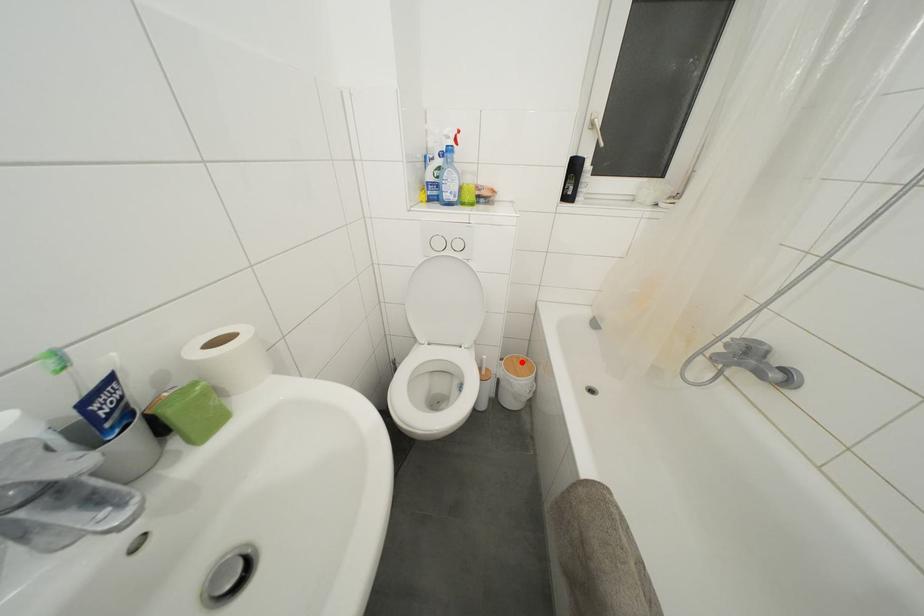
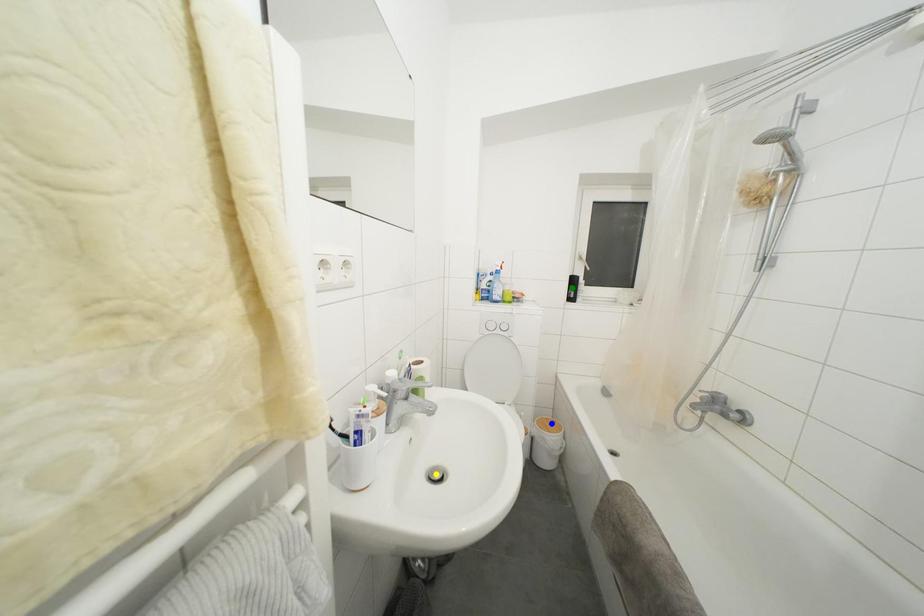
Question: I am providing you with two images of the same scene from different viewpoints. A red point is marked on the first image. You are given multiple points on the second image. Which mark in image 2 goes with the point in image 1?

Choices:
 (A) yellow point
 (B) blue point
 (C) green point

Answer: (B)